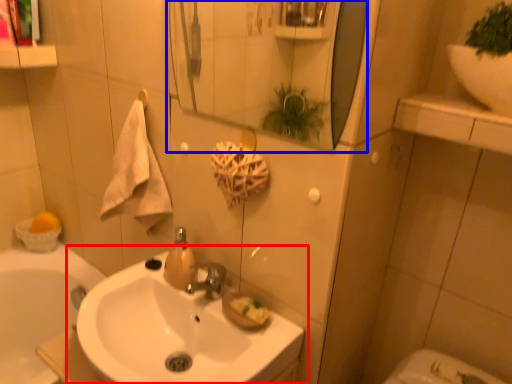
Question: Which of the following is the closest to the observer, sink (highlighted by a red box) or mirror (highlighted by a blue box)?

Choices:
 (A) sink
 (B) mirror

Answer: (B)